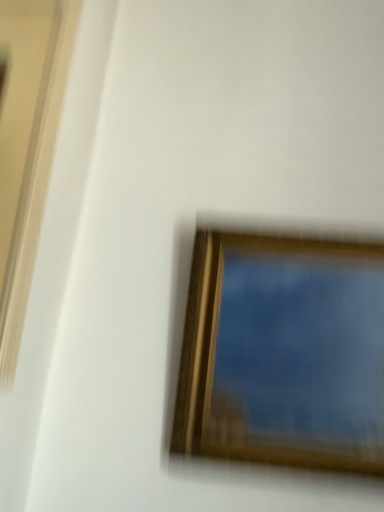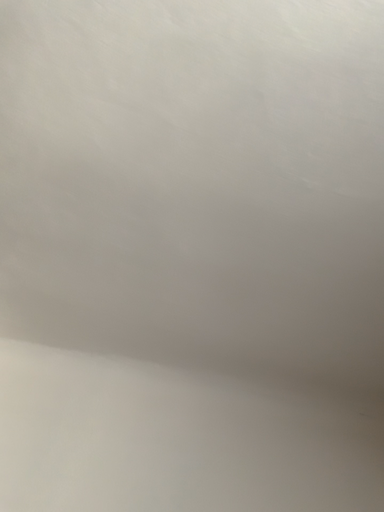
Question: How did the camera likely rotate when shooting the video?

Choices:
 (A) rotated left
 (B) rotated right

Answer: (B)